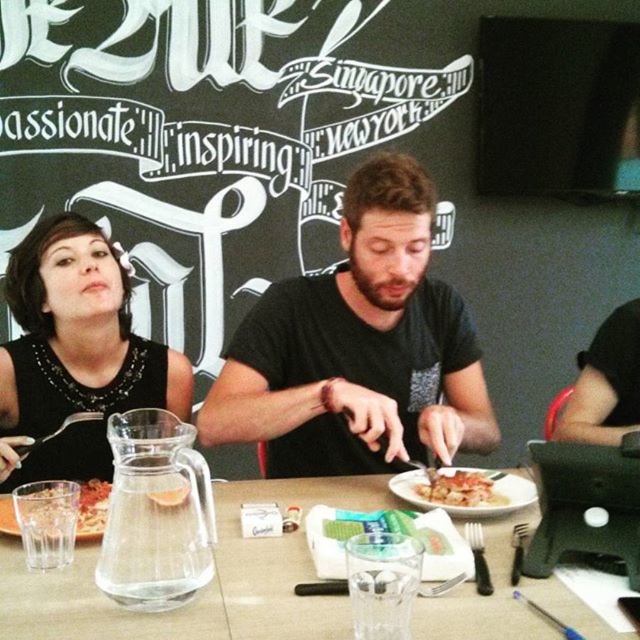
You are a waiter in a restaurant. You need to place a dessert menu on the table where the black matte shirt at center and clear glass water at center are located. Where should you place the dessert menu to avoid covering either item?

The black matte shirt at center is positioned over clear glass water at center, so you should place the dessert menu in an area of the table that is not covered by either object to avoid covering them.

You are a waiter at the restaurant and need to place a new drink order for the customer seated at the table. The customer wants their drink placed exactly where the clear glass water at center is currently located. Can you confirm if there is enough space at that position to place another drink?

The clear glass water at center is already occupying the location at point [205,588], so there is no space to place another drink there.